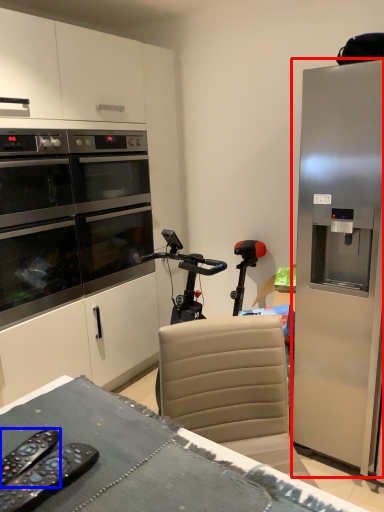
Question: Which object appears closest to the camera in this image, refrigerator (highlighted by a red box) or remote control (highlighted by a blue box)?

Choices:
 (A) refrigerator
 (B) remote control

Answer: (B)